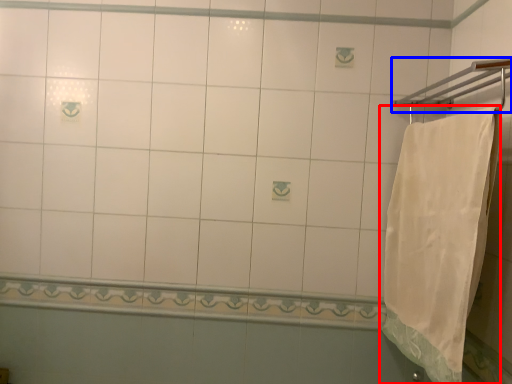
Question: Which point is closer to the camera, towel (highlighted by a red box) or towel bar (highlighted by a blue box)?

Choices:
 (A) towel
 (B) towel bar

Answer: (B)